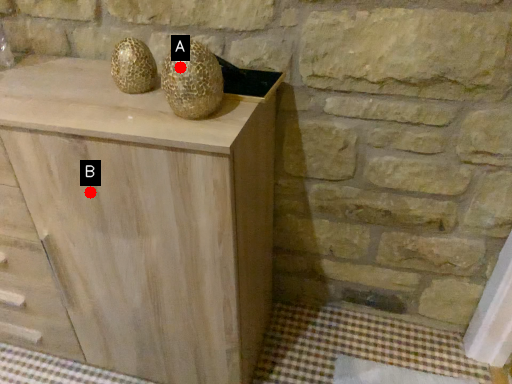
Question: Two points are circled on the image, labeled by A and B beside each circle. Which point is farther to the camera?

Choices:
 (A) A is further
 (B) B is further

Answer: (B)